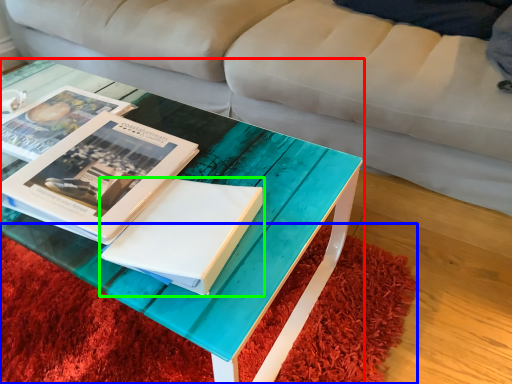
Question: Based on their relative distances, which object is nearer to coffee table (highlighted by a red box)? Choose from mat (highlighted by a blue box) and paperback book (highlighted by a green box).

Choices:
 (A) mat
 (B) paperback book

Answer: (B)